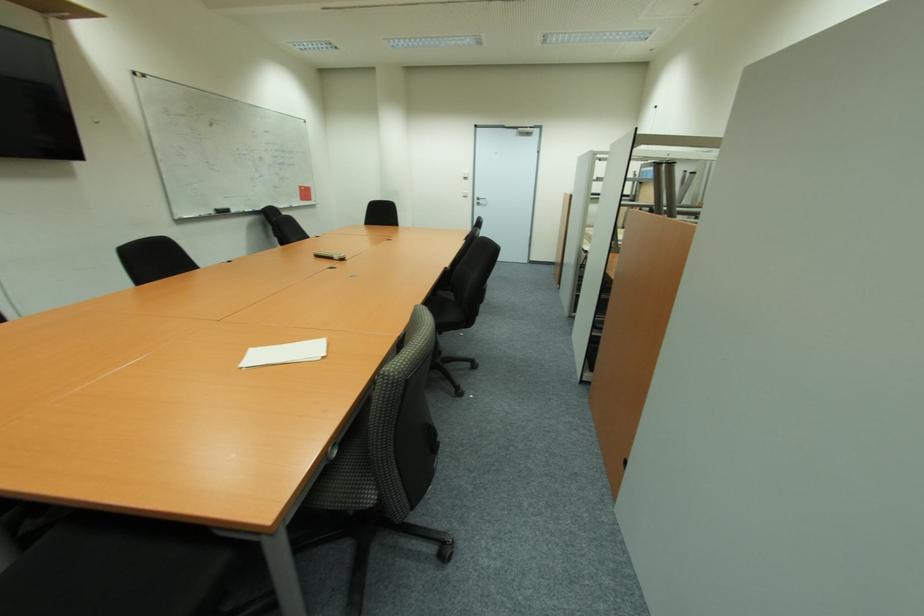
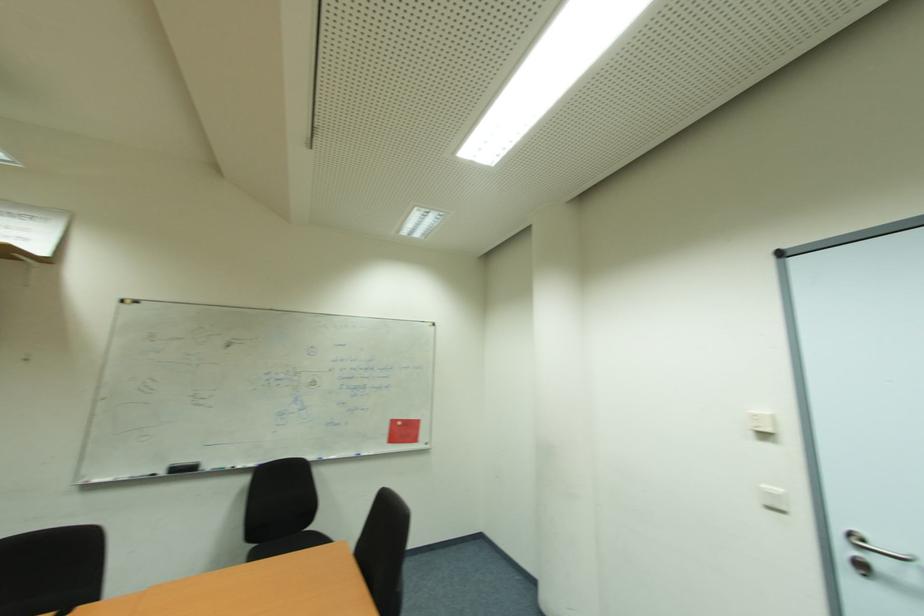
Locate, in the second image, the point that corresponds to (304,188) in the first image.

(397, 423)